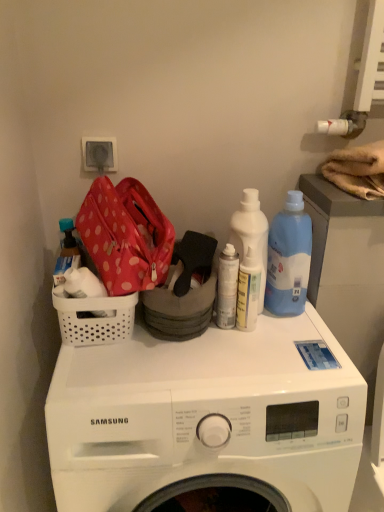
This screenshot has height=512, width=384. Find the location of `free space above white plastic washing machine at center (from a real-world perspective)`. free space above white plastic washing machine at center (from a real-world perspective) is located at coordinates (211, 353).